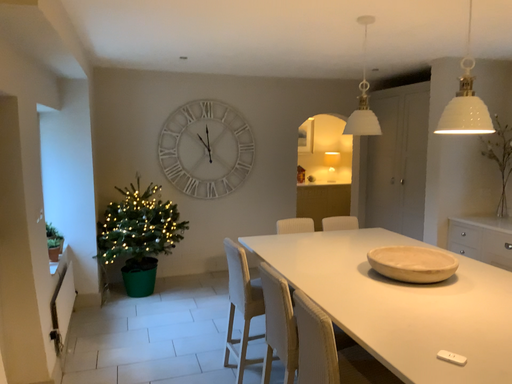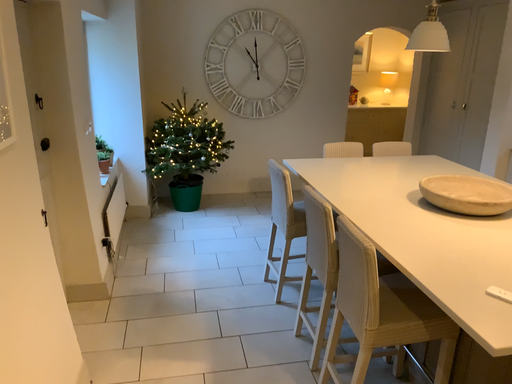
Question: Which way did the camera rotate in the video?

Choices:
 (A) rotated right
 (B) rotated left

Answer: (B)